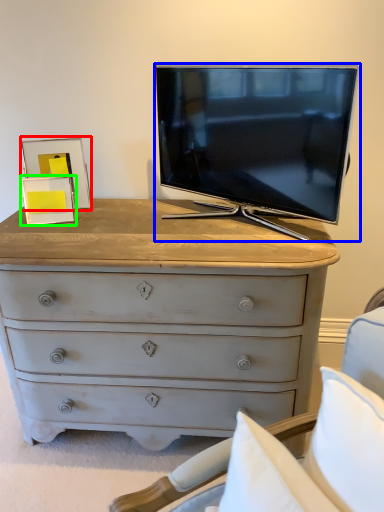
Question: Which object is the farthest from picture frame (highlighted by a red box)? Choose among these: television (highlighted by a blue box) or picture frame (highlighted by a green box).

Choices:
 (A) television
 (B) picture frame

Answer: (A)